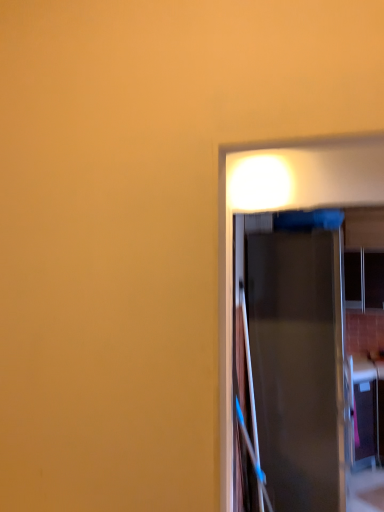
Question: From the image's perspective, is transparent glass window at right under metallic silver door at center?

Choices:
 (A) yes
 (B) no

Answer: (B)

Question: Is transparent glass window at right not close to metallic silver door at center?

Choices:
 (A) no
 (B) yes

Answer: (B)

Question: Considering the relative positions of transparent glass window at right and metallic silver door at center in the image provided, is transparent glass window at right behind metallic silver door at center?

Choices:
 (A) yes
 (B) no

Answer: (A)

Question: Can you confirm if transparent glass window at right is positioned to the left of metallic silver door at center?

Choices:
 (A) yes
 (B) no

Answer: (B)

Question: Does transparent glass window at right have a lesser height compared to metallic silver door at center?

Choices:
 (A) yes
 (B) no

Answer: (A)

Question: Is transparent glass window at right not inside metallic silver door at center?

Choices:
 (A) yes
 (B) no

Answer: (A)

Question: Is metallic silver door at center next to transparent glass window at right?

Choices:
 (A) yes
 (B) no

Answer: (B)

Question: Does metallic silver door at center come behind transparent glass window at right?

Choices:
 (A) yes
 (B) no

Answer: (B)

Question: Is metallic silver door at center taller than transparent glass window at right?

Choices:
 (A) no
 (B) yes

Answer: (B)

Question: Does metallic silver door at center have a smaller size compared to transparent glass window at right?

Choices:
 (A) yes
 (B) no

Answer: (B)

Question: Is there a large distance between metallic silver door at center and transparent glass window at right?

Choices:
 (A) no
 (B) yes

Answer: (B)

Question: Considering the relative positions of metallic silver door at center and transparent glass window at right in the image provided, is metallic silver door at center to the right of transparent glass window at right from the viewer's perspective?

Choices:
 (A) no
 (B) yes

Answer: (A)

Question: Is metallic silver door at center wider or thinner than transparent glass window at right?

Choices:
 (A) thin
 (B) wide

Answer: (B)